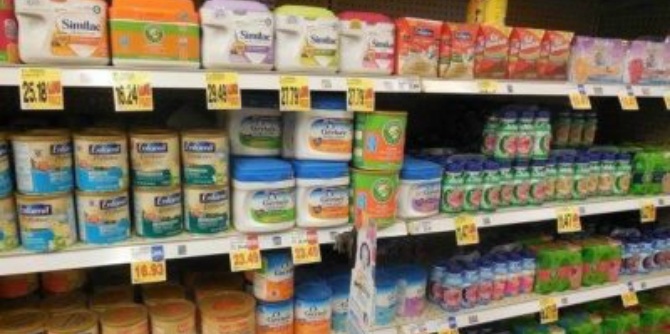
Find the location of a particular element. dark shadow on shelf is located at coordinates (423, 250).